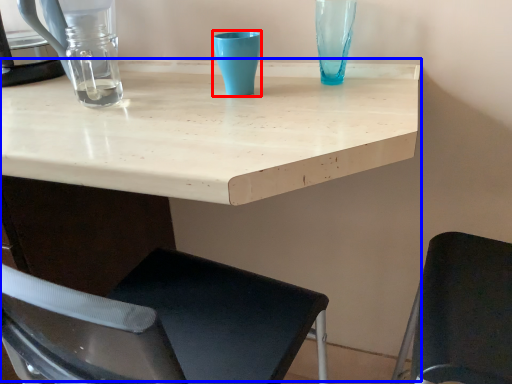
Question: Which point is closer to the camera, turquoise (highlighted by a red box) or table (highlighted by a blue box)?

Choices:
 (A) turquoise
 (B) table

Answer: (B)